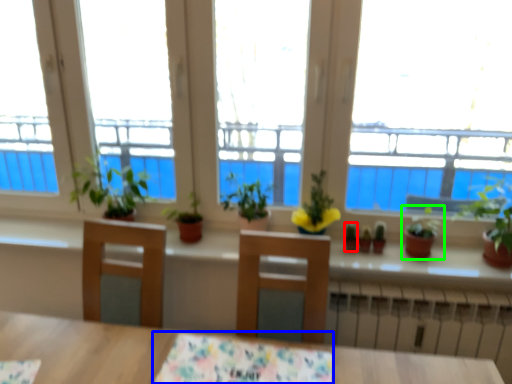
Question: Estimate the real-world distances between objects in this image. Which object is closer to plant (highlighted by a red box), tablecloth (highlighted by a blue box) or houseplant (highlighted by a green box)?

Choices:
 (A) tablecloth
 (B) houseplant

Answer: (B)